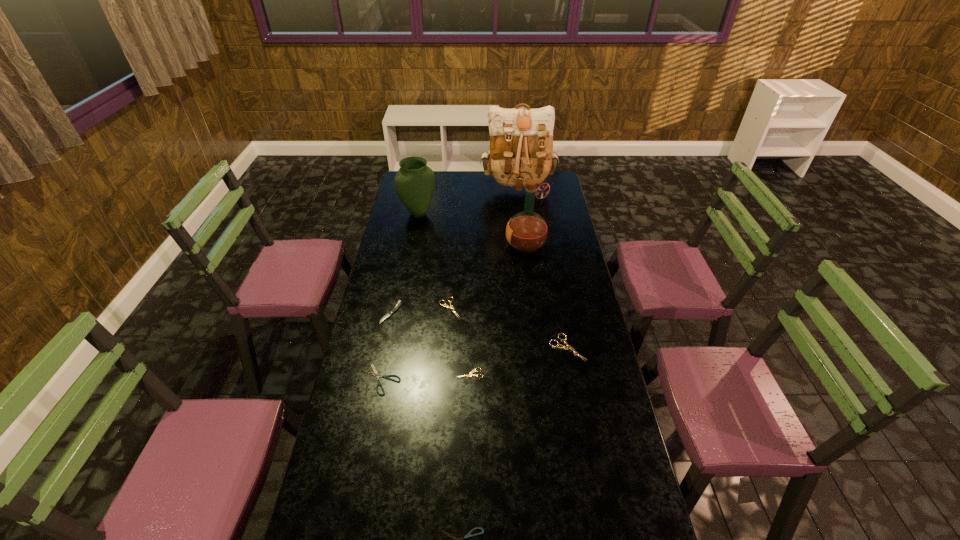
This screenshot has width=960, height=540. I want to click on the eighth closest object to the second farthest shears, so coord(521,139).

Image resolution: width=960 pixels, height=540 pixels. Find the location of `object that is the eighth closest one to the tallest object`. object that is the eighth closest one to the tallest object is located at coordinates (468, 535).

Identify which shears is the fourth nearest to the brown backpack. Please provide its 2D coordinates. Your answer should be formatted as a tuple, i.e. [(x, y)], where the tuple contains the x and y coordinates of a point satisfying the conditions above.

[(375, 373)]

Identify which shears is the second nearest to the leftmost shears. Please provide its 2D coordinates. Your answer should be formatted as a tuple, i.e. [(x, y)], where the tuple contains the x and y coordinates of a point satisfying the conditions above.

[(447, 306)]

Locate which beige shears ranks second in proximity to the smallest beige shears. Please provide its 2D coordinates. Your answer should be formatted as a tuple, i.e. [(x, y)], where the tuple contains the x and y coordinates of a point satisfying the conditions above.

[(563, 347)]

The height and width of the screenshot is (540, 960). I want to click on the closest beige shears relative to the brown backpack, so click(447, 306).

Where is `black shears that is the second closest to the nearest beige shears`? This screenshot has width=960, height=540. black shears that is the second closest to the nearest beige shears is located at coordinates (468, 535).

The height and width of the screenshot is (540, 960). What are the coordinates of `free point that satisfies the following two spatial constraints: 1. on the front label of the seventh nearest object; 2. on the front side of the nearest beige shears` in the screenshot? It's located at 542,373.